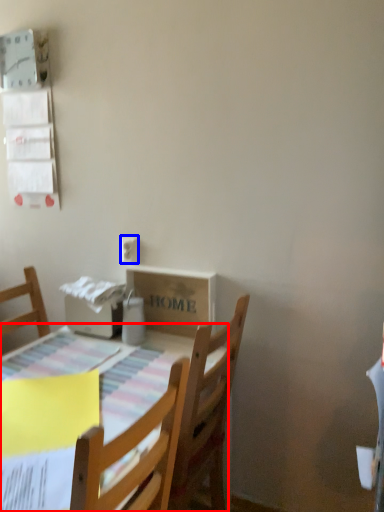
Question: Which point is further to the camera, table (highlighted by a red box) or electric outlet (highlighted by a blue box)?

Choices:
 (A) table
 (B) electric outlet

Answer: (B)